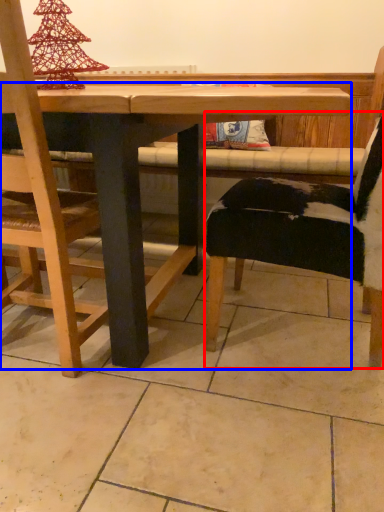
Question: Which object appears closest to the camera in this image, chair (highlighted by a red box) or table (highlighted by a blue box)?

Choices:
 (A) chair
 (B) table

Answer: (B)